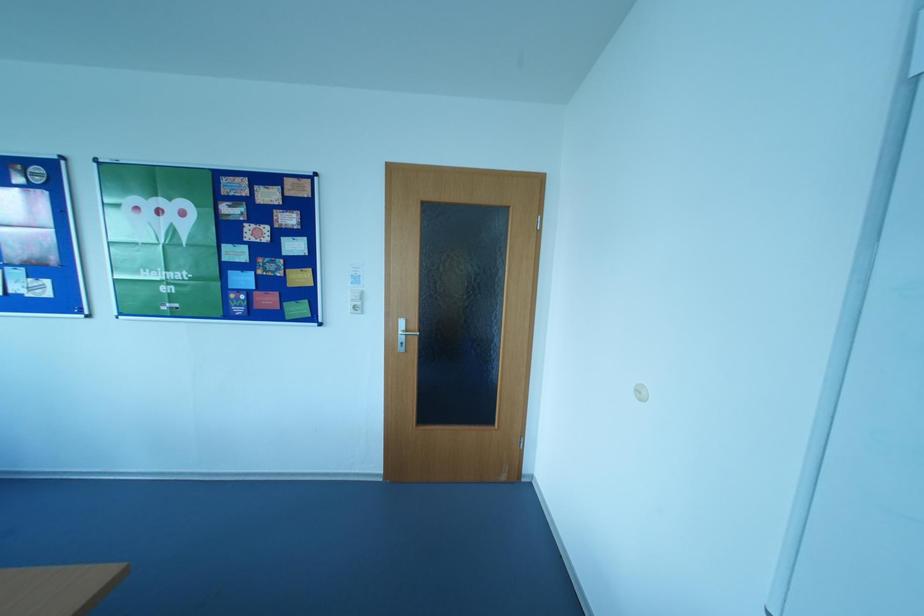
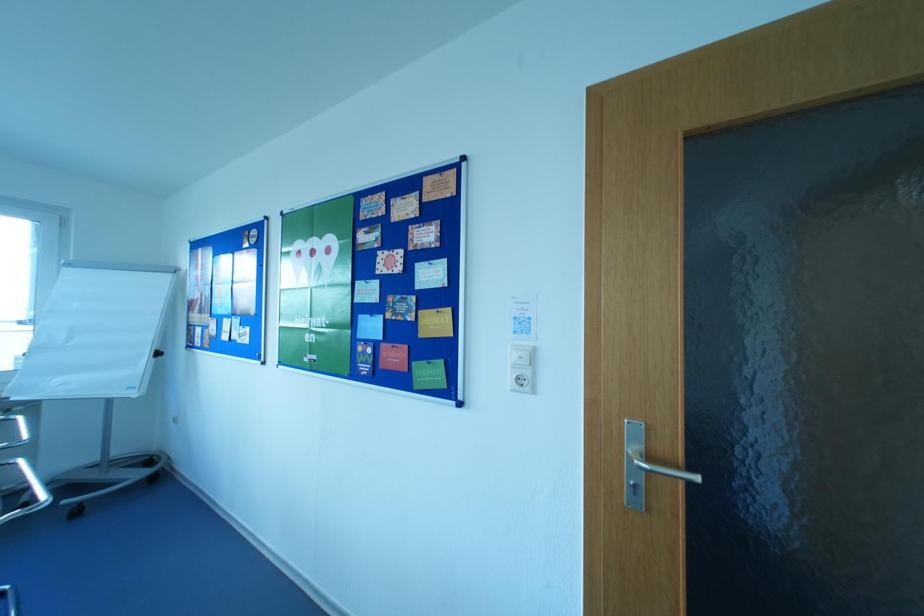
Question: The camera is either moving clockwise (left) or counter-clockwise (right) around the object. The first image is from the beginning of the video and the second image is from the end. Is the camera moving left or right when shooting the video?

Choices:
 (A) Left
 (B) Right

Answer: (B)